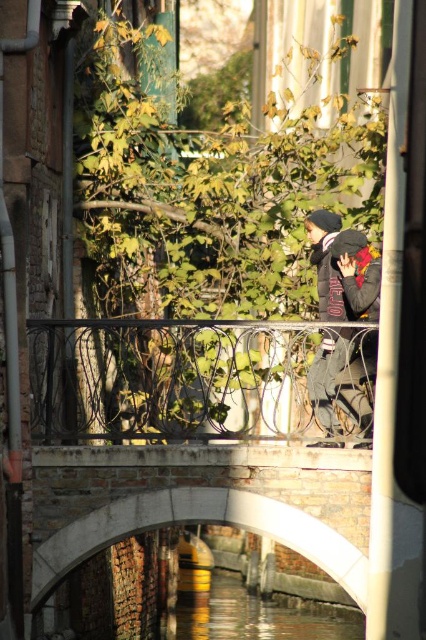
You are standing at the point with coordinates point [339,216] and want to walk to the point with coordinates point [138,481]. Given the narrow canal bridge described, is the path between these two points clear of any obstructions?

Point [138,481] is in front of point [339,216], so the path between them is clear of obstructions.

You are a tour guide leading a group across the concrete bridge at center and near the clear water at canal center. Can you confirm if the bridge is wider than the canal?

The concrete bridge at center has a larger size compared to clear water at canal center, so yes, the bridge is wider than the canal.